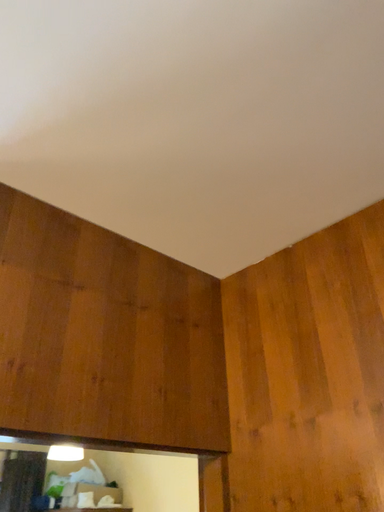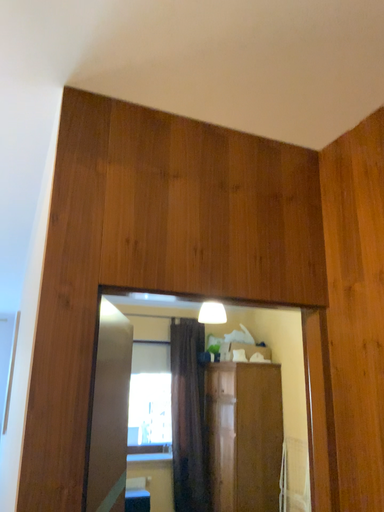
Question: How did the camera likely rotate when shooting the video?

Choices:
 (A) rotated upward
 (B) rotated downward

Answer: (B)